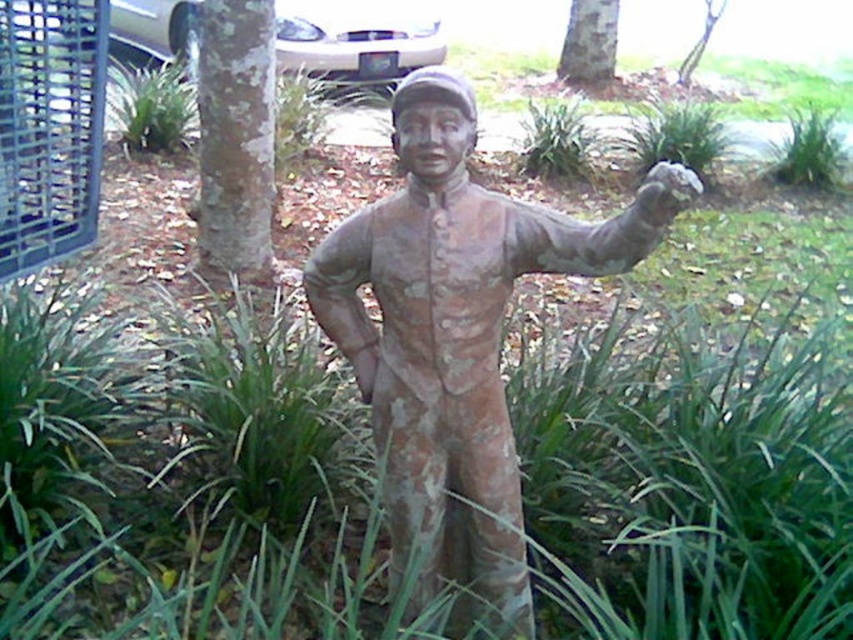
Question: Which object appears farthest from the camera in this image?

Choices:
 (A) green leafy tree at center
 (B) brown rough bark at center
 (C) smooth bark tree at center

Answer: (A)

Question: Which object is the farthest from the rusty bronze statue at center?

Choices:
 (A) green leafy tree at center
 (B) smooth bark tree at center
 (C) brown rough bark at center

Answer: (A)

Question: Can you confirm if brown rough bark at center is wider than smooth bark tree at center?

Choices:
 (A) yes
 (B) no

Answer: (A)

Question: Does brown rough bark at center have a smaller size compared to smooth bark tree at center?

Choices:
 (A) yes
 (B) no

Answer: (B)

Question: Is smooth bark tree at center further to the viewer compared to green leafy tree at center?

Choices:
 (A) yes
 (B) no

Answer: (B)

Question: Which point appears closest to the camera in this image?

Choices:
 (A) (607, 36)
 (B) (219, 269)
 (C) (682, 64)
 (D) (434, 419)

Answer: (D)